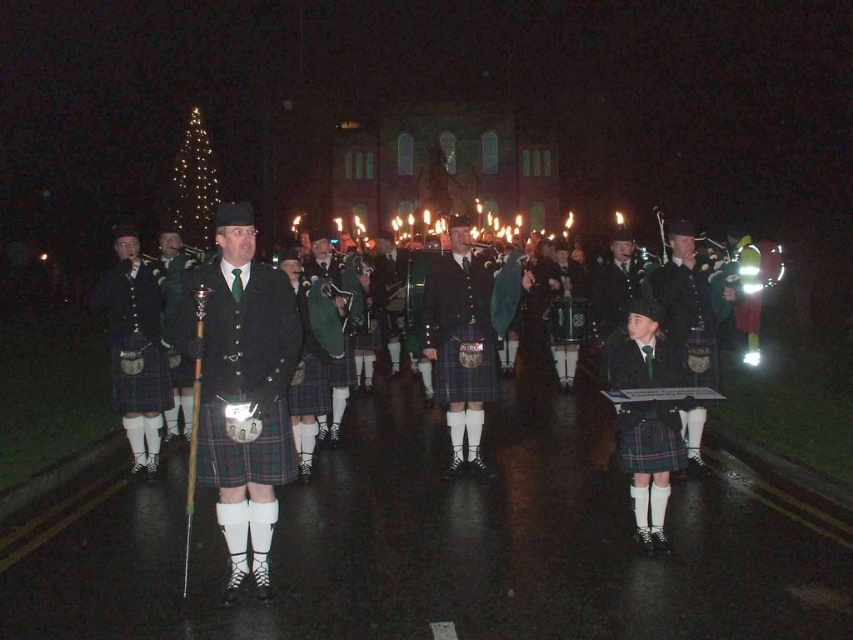
Question: Among these points, which one is farthest from the camera?

Choices:
 (A) (242, 385)
 (B) (467, 275)
 (C) (189, 392)
 (D) (694, 337)

Answer: (B)

Question: Which is nearer to the green plaid kilt at center?

Choices:
 (A) plaid fabric kilt at center
 (B) plaid kilt at center
 (C) green wool kilt at center
 (D) matte black kilt at right

Answer: (C)

Question: Can you confirm if matte black kilt at right is wider than green wool kilt at center?

Choices:
 (A) yes
 (B) no

Answer: (B)

Question: Which of the following is the farthest from the observer?

Choices:
 (A) (166, 323)
 (B) (270, 376)

Answer: (A)

Question: Does matte black kilt at center have a larger size compared to plaid kilt at center?

Choices:
 (A) yes
 (B) no

Answer: (A)

Question: Can you confirm if green plaid kilt at center is positioned above plaid kilt at center?

Choices:
 (A) yes
 (B) no

Answer: (B)